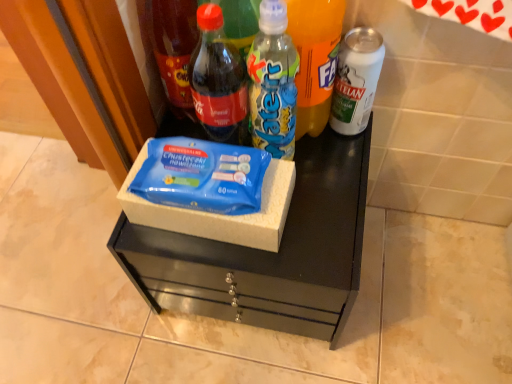
What are the coordinates of `vacant area that is in front of translucent plastic water bottle at center, the 3th bottle from the left` in the screenshot? It's located at (300, 231).